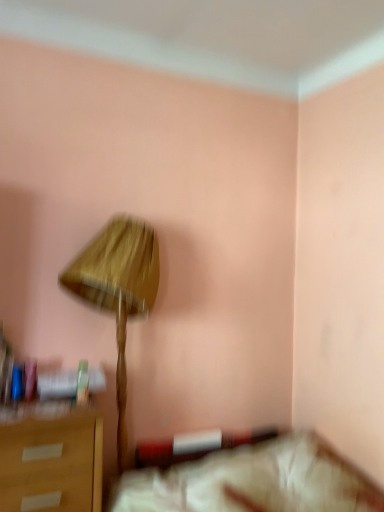
Question: From the image's perspective, is wooden lampshade at center located above or below white fabric bed at lower right?

Choices:
 (A) below
 (B) above

Answer: (B)

Question: From their relative heights in the image, would you say wooden lampshade at center is taller or shorter than white fabric bed at lower right?

Choices:
 (A) short
 (B) tall

Answer: (B)

Question: From a real-world perspective, is wooden lampshade at center physically located above or below white fabric bed at lower right?

Choices:
 (A) below
 (B) above

Answer: (B)

Question: Which is correct: white fabric bed at lower right is inside wooden lampshade at center, or outside of it?

Choices:
 (A) inside
 (B) outside

Answer: (B)

Question: Is white fabric bed at lower right taller or shorter than wooden lampshade at center?

Choices:
 (A) tall
 (B) short

Answer: (B)

Question: From the image's perspective, is white fabric bed at lower right located above or below wooden lampshade at center?

Choices:
 (A) above
 (B) below

Answer: (B)

Question: Is white fabric bed at lower right in front of or behind wooden lampshade at center in the image?

Choices:
 (A) front
 (B) behind

Answer: (A)